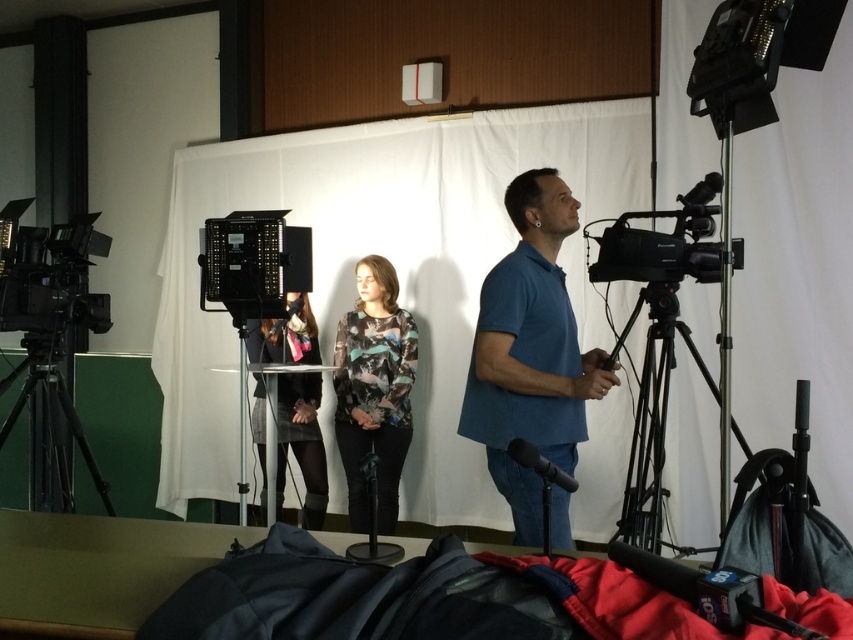
You are a photographer setting up for a photoshoot in the studio. You need to position a camera on the black metal tripod at right so that it can capture the dark gray fabric dress at center clearly. Is the tripod tall enough to do this?

The black metal tripod at right is shorter than the dark gray fabric dress at center. Therefore, the tripod may not be tall enough to position the camera at an appropriate height to capture the dress clearly unless adjusted.

You are a camera operator in a studio. You need to adjust the camera to focus on the point at coordinates point (525, 307). The current distance between the camera and the point is 2.30 meters. What should you do to ensure the point is in focus?

To ensure the point at coordinates point (525, 307) is in focus, you should adjust the camera lens to focus at a distance of 2.30 meters since the point is currently 2.30 meters away from the camera.